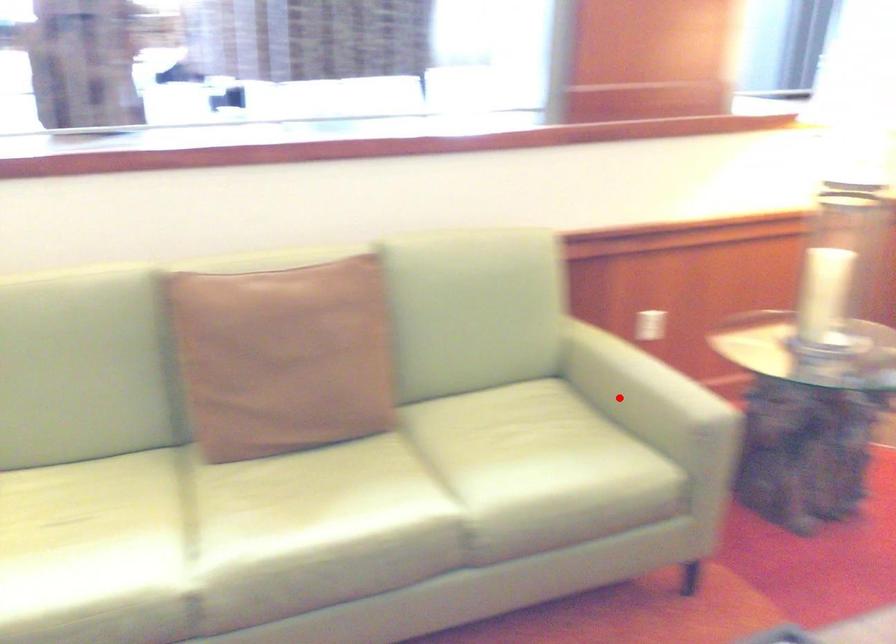
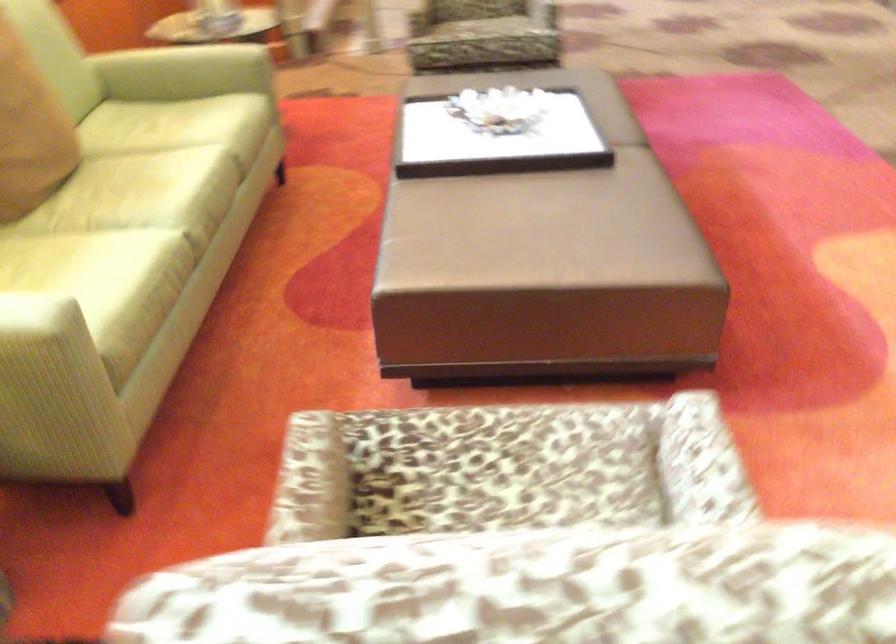
Find the pixel in the second image that matches the highlighted location in the first image.

(194, 60)